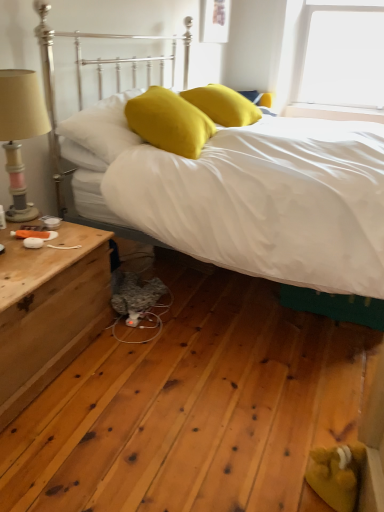
Question: Can you confirm if wooden nightstand at left is wider than wooden beige lampshade at left?

Choices:
 (A) no
 (B) yes

Answer: (B)

Question: From a real-world perspective, is wooden nightstand at left under wooden beige lampshade at left?

Choices:
 (A) no
 (B) yes

Answer: (B)

Question: Is wooden nightstand at left further to the viewer compared to wooden beige lampshade at left?

Choices:
 (A) no
 (B) yes

Answer: (A)

Question: Does wooden nightstand at left appear on the left side of wooden beige lampshade at left?

Choices:
 (A) no
 (B) yes

Answer: (A)

Question: Does wooden nightstand at left have a lesser height compared to wooden beige lampshade at left?

Choices:
 (A) yes
 (B) no

Answer: (A)

Question: From the image's perspective, is wooden nightstand at left beneath wooden beige lampshade at left?

Choices:
 (A) no
 (B) yes

Answer: (B)

Question: Considering the relative positions of yellow matte pillow at upper left, which is counted as the 3th pillow, starting from the right, and wooden beige lampshade at left in the image provided, is yellow matte pillow at upper left, which is counted as the 3th pillow, starting from the right, to the right of wooden beige lampshade at left from the viewer's perspective?

Choices:
 (A) yes
 (B) no

Answer: (A)

Question: Is yellow matte pillow at upper left, which is counted as the 3th pillow, starting from the right, in front of wooden beige lampshade at left?

Choices:
 (A) yes
 (B) no

Answer: (B)

Question: Would you say wooden beige lampshade at left is part of yellow matte pillow at upper left, marked as the 1th pillow in a left-to-right arrangement,'s contents?

Choices:
 (A) yes
 (B) no

Answer: (B)

Question: From a real-world perspective, is yellow matte pillow at upper left, which is counted as the 3th pillow, starting from the right, on wooden beige lampshade at left?

Choices:
 (A) no
 (B) yes

Answer: (A)

Question: Considering the relative sizes of yellow matte pillow at upper left, marked as the 1th pillow in a left-to-right arrangement, and wooden beige lampshade at left in the image provided, is yellow matte pillow at upper left, marked as the 1th pillow in a left-to-right arrangement, bigger than wooden beige lampshade at left?

Choices:
 (A) yes
 (B) no

Answer: (A)

Question: From a real-world perspective, is yellow matte pillow at upper left, which is counted as the 3th pillow, starting from the right, below wooden beige lampshade at left?

Choices:
 (A) yes
 (B) no

Answer: (A)

Question: Is matte yellow pillow at center, which ranks as the third pillow in left-to-right order, closer to the viewer compared to wooden beige lampshade at left?

Choices:
 (A) yes
 (B) no

Answer: (B)